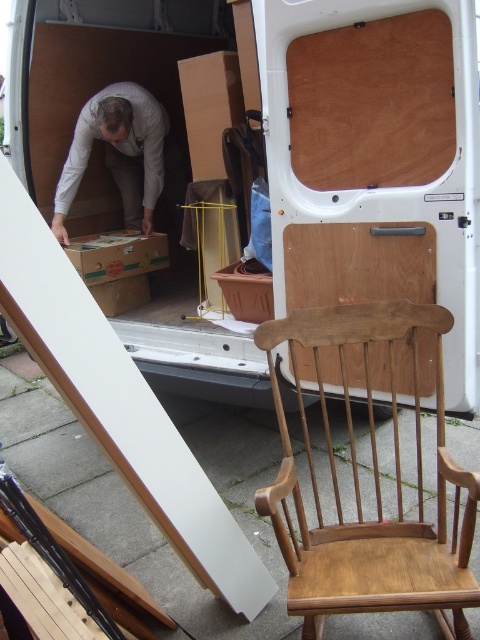
You are helping someone move and need to load the light brown wooden rocking chair at center and the gray fabric bag at center into the van. Based on their positions in the image, which object should you load first to ensure the other can fit properly?

The light brown wooden rocking chair at center is in front of the gray fabric bag at center, so you should load the gray fabric bag at center first to make space for the rocking chair.

You are helping to load items into the van and need to decide where to place the wooden chair back at center and the gray fabric bag at center. Based on their sizes, which item should be placed first into the van to maximize space efficiency?

The wooden chair back at center has a smaller size compared to gray fabric bag at center, so it should be placed first to allow the larger gray fabric bag at center to be placed on top or around it for better space efficiency.

You are standing at the entrance of the driveway and want to place a new bench exactly where the light brown wooden rocking chair at center is currently located. According to the image, what are the coordinates where you should place the bench?

The light brown wooden rocking chair at center is located at point (x=374, y=486), so you should place the bench at those coordinates.